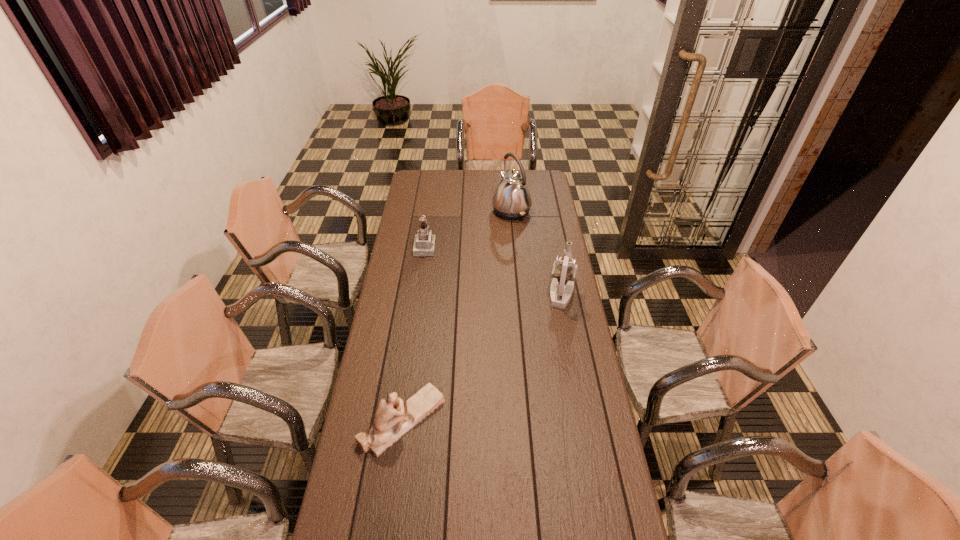
Where is `free space located on the front-facing side of the shortest object`? The image size is (960, 540). free space located on the front-facing side of the shortest object is located at coordinates (486, 420).

Locate an element on the screen. The width and height of the screenshot is (960, 540). kettle situated at the right edge is located at coordinates (x=512, y=200).

The height and width of the screenshot is (540, 960). In order to click on microscope that is at the right edge in this screenshot , I will do `click(564, 270)`.

You are a GUI agent. You are given a task and a screenshot of the screen. Output one action in this format:
    pyautogui.click(x=<x>, y=<y>)
    Task: Click on the blank area at the left edge
    The height and width of the screenshot is (540, 960).
    Given the screenshot: What is the action you would take?
    pyautogui.click(x=418, y=196)

In the image, there is a desktop. Where is `vacant area at the right edge`? This screenshot has height=540, width=960. vacant area at the right edge is located at coordinates (588, 437).

At what (x,y) coordinates should I click in order to perform the action: click on free space at the far left corner. Please return your answer as a coordinate pair (x, y). The width and height of the screenshot is (960, 540). Looking at the image, I should click on (431, 181).

In the image, there is a desktop. Where is `vacant region at the far right corner`? vacant region at the far right corner is located at coordinates (544, 181).

The image size is (960, 540). Find the location of `vacant point located between the second tallest object and the tallest object`. vacant point located between the second tallest object and the tallest object is located at coordinates point(537,252).

I want to click on vacant region between the nearest object and the third shortest object, so click(x=482, y=357).

I want to click on vacant space that's between the nearer figurine and the rightmost object, so click(x=482, y=357).